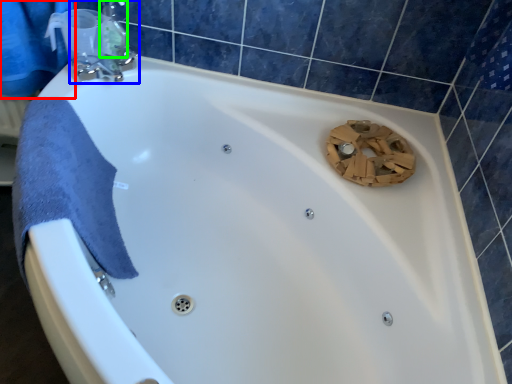
Question: Considering the real-world distances, which object is farthest from shower curtain (highlighted by a red box)? tap (highlighted by a blue box) or toiletry (highlighted by a green box)?

Choices:
 (A) tap
 (B) toiletry

Answer: (B)